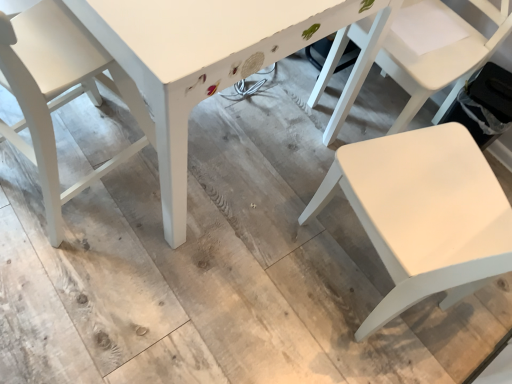
This screenshot has width=512, height=384. I want to click on vacant space in front of white matte chair at left, acting as the third chair starting from the right, so point(66,282).